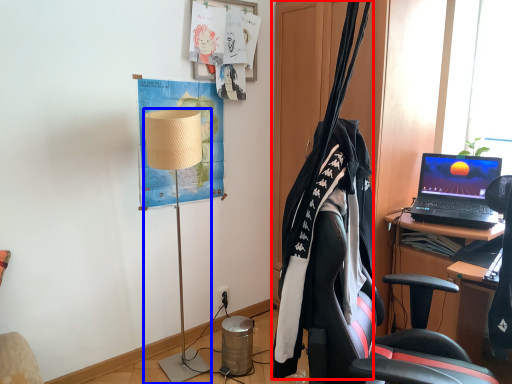
Question: Which point is closer to the camera, clothesline (highlighted by a red box) or lamp (highlighted by a blue box)?

Choices:
 (A) clothesline
 (B) lamp

Answer: (A)